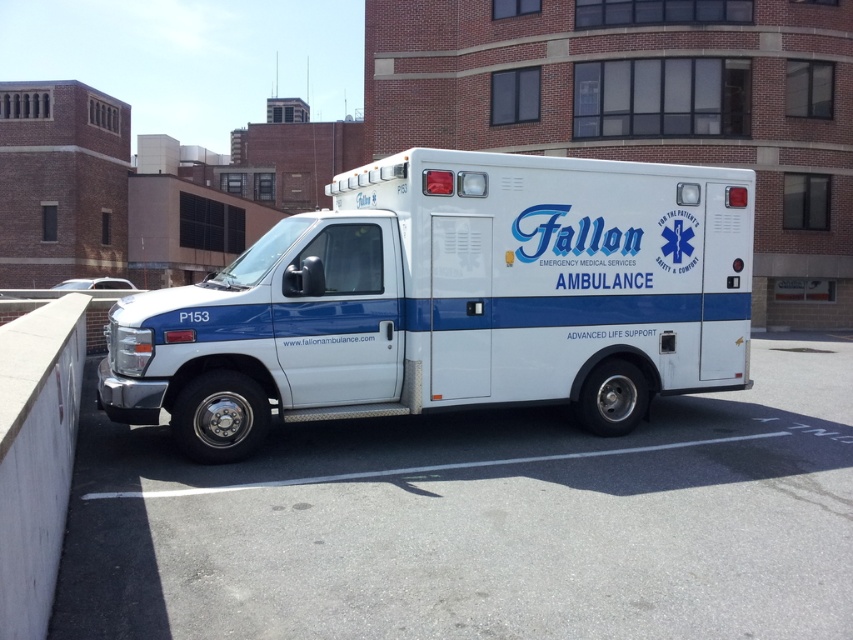
You are standing in front of the ambulance and want to check the ground where you are standing. What is the material of the ground at your current position, which is at point (x=480, y=522)?

The white smooth asphalt at center is located at point (x=480, y=522), so the material of the ground at your current position is white smooth asphalt.

You are a delivery person with a box that needs to be placed between the white smooth asphalt at center and the white glossy ambulance at center. The box requires a minimum of 5 feet of space to be safely placed. Can you safely place the box there?

The white smooth asphalt at center and white glossy ambulance at center are 4.97 feet apart from each other. Since the required minimum space is 5 feet, the box cannot be safely placed between them.